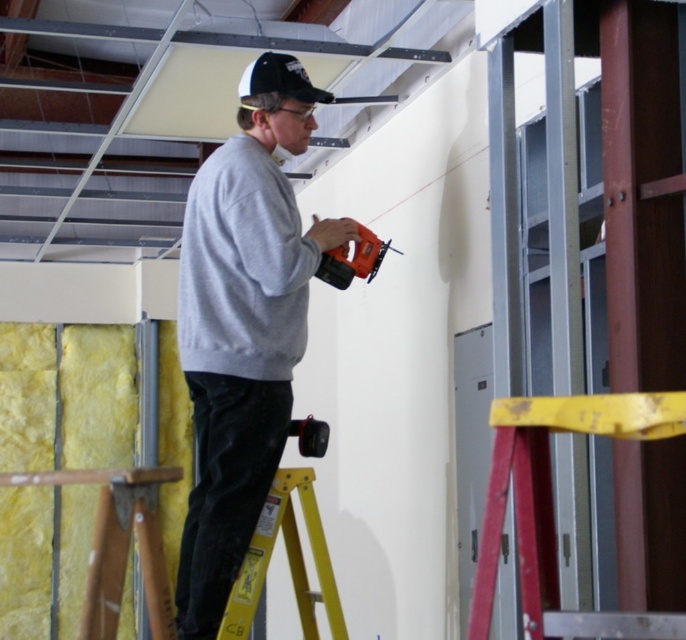
Does yellow/red painted metal at right come behind orange plastic drill at center?

No, yellow/red painted metal at right is in front of orange plastic drill at center.

Which is more to the right, yellow/red painted metal at right or orange plastic drill at center?

From the viewer's perspective, yellow/red painted metal at right appears more on the right side.

Where is `yellow/red painted metal at right`? yellow/red painted metal at right is located at coordinates (552, 506).

At what (x,y) coordinates should I click in order to perform the action: click on yellow/red painted metal at right. Please return your answer as a coordinate pair (x, y). This screenshot has height=640, width=686. Looking at the image, I should click on click(x=552, y=506).

Does yellow/red painted metal at right have a lesser height compared to black fabric baseball cap at upper center?

Incorrect, yellow/red painted metal at right's height does not fall short of black fabric baseball cap at upper center's.

Based on the photo, does yellow/red painted metal at right have a greater height compared to black fabric baseball cap at upper center?

Correct, yellow/red painted metal at right is much taller as black fabric baseball cap at upper center.

Image resolution: width=686 pixels, height=640 pixels. Describe the element at coordinates (552, 506) in the screenshot. I see `yellow/red painted metal at right` at that location.

Where is `yellow/red painted metal at right`? The image size is (686, 640). yellow/red painted metal at right is located at coordinates (552, 506).

Does gray sweatshirt at center have a larger size compared to yellow/yellowish metal ladder at lower center?

Yes.

In the scene shown: Does gray sweatshirt at center appear on the right side of yellow/yellowish metal ladder at lower center?

In fact, gray sweatshirt at center is to the left of yellow/yellowish metal ladder at lower center.

Does point (307, 304) come closer to viewer compared to point (309, 483)?

That is False.

Image resolution: width=686 pixels, height=640 pixels. In order to click on gray sweatshirt at center in this screenshot , I will do `click(241, 268)`.